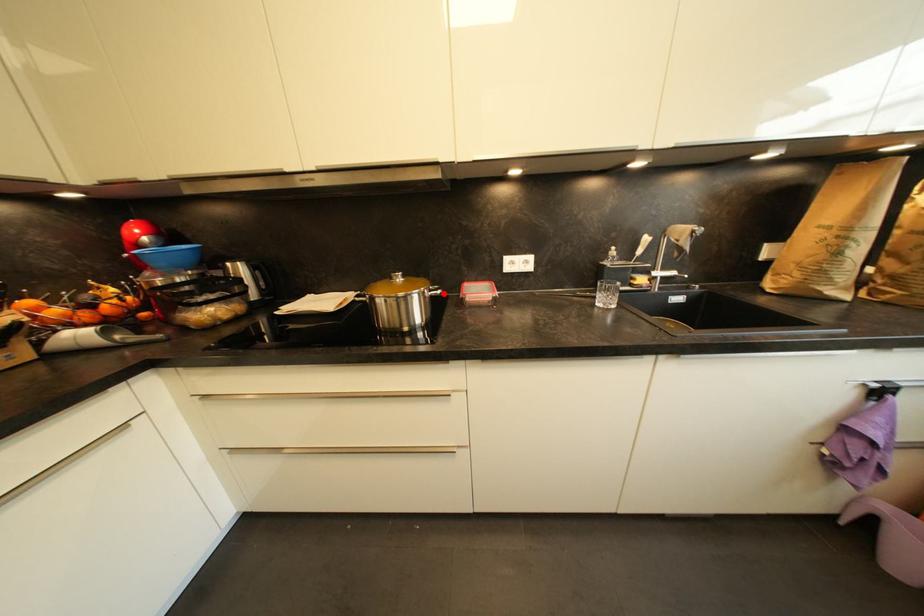
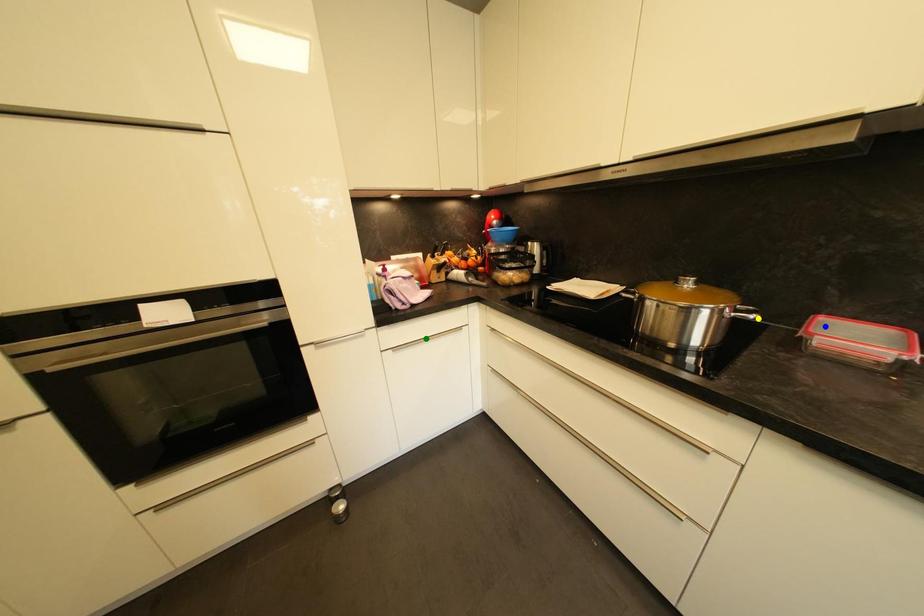
Question: I am providing you with two images of the same scene from different viewpoints. A red point is marked on the first image. You are given multiple points on the second image. In image 2, which mark is for the same physical point as the one in image 1?

Choices:
 (A) green point
 (B) yellow point
 (C) blue point

Answer: (B)